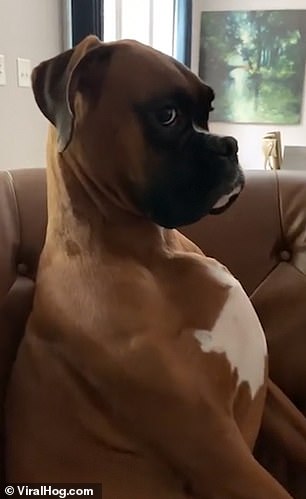
Image resolution: width=306 pixels, height=499 pixels. I want to click on wall, so click(26, 21).